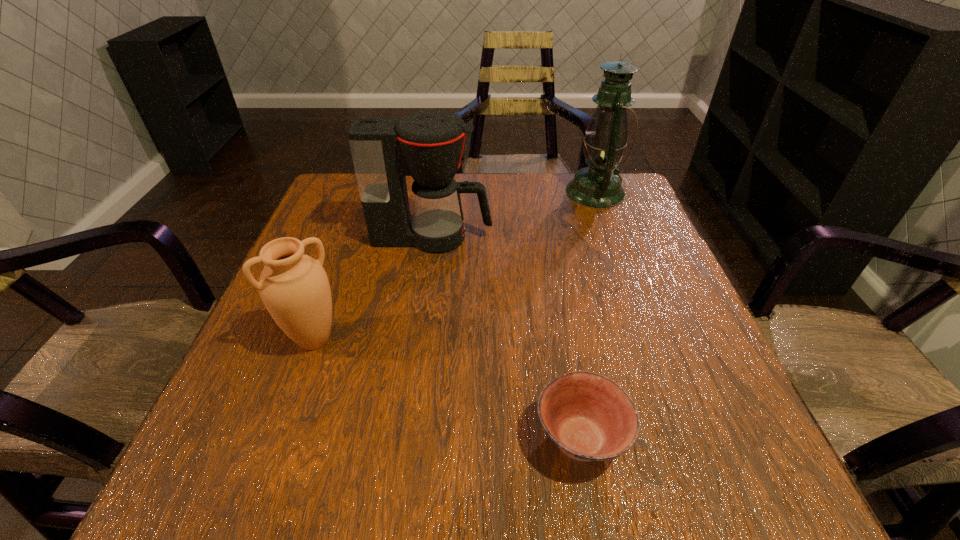
Where is `free point that satisfies the following two spatial constraints: 1. on the front side of the rightmost object; 2. pour from the carafe of the third shortest object`? free point that satisfies the following two spatial constraints: 1. on the front side of the rightmost object; 2. pour from the carafe of the third shortest object is located at coordinates (612, 237).

Where is `free space in the image that satisfies the following two spatial constraints: 1. pour from the carafe of the shortest object; 2. on the right side of the coffee maker`? This screenshot has width=960, height=540. free space in the image that satisfies the following two spatial constraints: 1. pour from the carafe of the shortest object; 2. on the right side of the coffee maker is located at coordinates (405, 438).